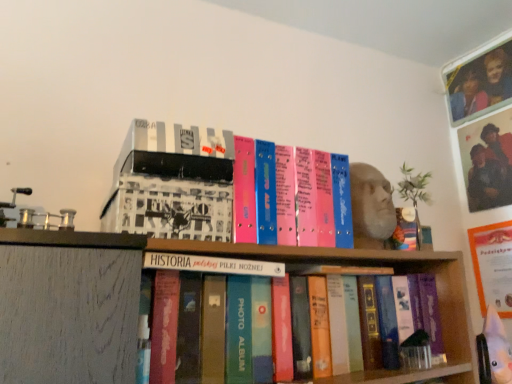
This screenshot has width=512, height=384. Describe the element at coordinates (480, 83) in the screenshot. I see `matte plastic photo frame at upper right` at that location.

Locate an element on the screen. The height and width of the screenshot is (384, 512). white matte box at upper left, which ranks as the 2th book in bottom-to-top order is located at coordinates (170, 208).

Image resolution: width=512 pixels, height=384 pixels. I want to click on matte plastic photo frame at upper right, so click(x=480, y=83).

Is orange matte paper at upper right wider than white matte box at upper left, which ranks as the 2th book in bottom-to-top order?

Incorrect, the width of orange matte paper at upper right does not surpass that of white matte box at upper left, which ranks as the 2th book in bottom-to-top order.

Would you say orange matte paper at upper right is a long distance from white matte box at upper left, which ranks as the 2th book in bottom-to-top order?

Yes, orange matte paper at upper right is far from white matte box at upper left, which ranks as the 2th book in bottom-to-top order.

Image resolution: width=512 pixels, height=384 pixels. Identify the location of paperback book below the white matte box at upper left, acting as the first book starting from the top (from a real-world perspective). (493, 266).

Is white matte box at upper left, acting as the first book starting from the top, surrounded by orange matte paper at upper right?

That's incorrect, white matte box at upper left, acting as the first book starting from the top, is not inside orange matte paper at upper right.

From a real-world perspective, which object rests below the other?

In real-world perspective, hardcover book at center, which ranks as the first book in bottom-to-top order, is lower.

Is hardcover book at center, which is the 2th book in top-to-bottom order, outside of white matte box at upper left, which ranks as the 2th book in bottom-to-top order?

Yes, hardcover book at center, which is the 2th book in top-to-bottom order, is not within white matte box at upper left, which ranks as the 2th book in bottom-to-top order.

Is hardcover book at center, which is the 2th book in top-to-bottom order, beside white matte box at upper left, which ranks as the 2th book in bottom-to-top order?

Indeed, hardcover book at center, which is the 2th book in top-to-bottom order, and white matte box at upper left, which ranks as the 2th book in bottom-to-top order, are beside each other and touching.

Which is behind, point (214, 269) or point (162, 212)?

The point (214, 269) is farther.

Is orange matte paper at upper right looking in the opposite direction of hardcover book at center, which ranks as the first book in bottom-to-top order?

No, orange matte paper at upper right is not facing away from hardcover book at center, which ranks as the first book in bottom-to-top order.

In the scene shown: From the image's perspective, does orange matte paper at upper right appear higher than hardcover book at center, which is the 2th book in top-to-bottom order?

No, from the image's perspective, orange matte paper at upper right is not on top of hardcover book at center, which is the 2th book in top-to-bottom order.

Is orange matte paper at upper right shorter than hardcover book at center, which ranks as the first book in bottom-to-top order?

No, orange matte paper at upper right is not shorter than hardcover book at center, which ranks as the first book in bottom-to-top order.

From the image's perspective, which one is positioned higher, matte plastic photo frame at upper right or white matte box at upper left, which ranks as the 2th book in bottom-to-top order?

matte plastic photo frame at upper right.

Would you say matte plastic photo frame at upper right is a long distance from white matte box at upper left, acting as the first book starting from the top?

That's right, there is a large distance between matte plastic photo frame at upper right and white matte box at upper left, acting as the first book starting from the top.

Does point (478, 100) come behind point (150, 177)?

Yes, it is behind point (150, 177).

Is orange matte paper at upper right at the back of matte plastic photo frame at upper right?

That's not correct — matte plastic photo frame at upper right is not looking away from orange matte paper at upper right.

From a real-world perspective, who is located lower, matte plastic photo frame at upper right or orange matte paper at upper right?

orange matte paper at upper right is physically lower.

Considering the relative sizes of matte plastic photo frame at upper right and orange matte paper at upper right in the image provided, is matte plastic photo frame at upper right bigger than orange matte paper at upper right?

Yes.

Which object is positioned more to the left, matte plastic photo frame at upper right or orange matte paper at upper right?

Positioned to the left is orange matte paper at upper right.

Is point (507, 275) positioned behind point (494, 70)?

No, (507, 275) is closer to viewer.

How many degrees apart are the facing directions of orange matte paper at upper right and matte plastic photo frame at upper right?

0 degrees separate the facing orientations of orange matte paper at upper right and matte plastic photo frame at upper right.

Can you confirm if orange matte paper at upper right is positioned to the right of matte plastic photo frame at upper right?

In fact, orange matte paper at upper right is to the left of matte plastic photo frame at upper right.

Considering the sizes of objects orange matte paper at upper right and matte plastic photo frame at upper right in the image provided, who is thinner, orange matte paper at upper right or matte plastic photo frame at upper right?

matte plastic photo frame at upper right is thinner.

Locate an element on the screen. This screenshot has height=384, width=512. book that appears below the white matte box at upper left, which ranks as the 2th book in bottom-to-top order (from a real-world perspective) is located at coordinates (212, 264).

Which point is more distant from viewer, (178,185) or (263,267)?

The point (263,267) is farther.

Is white matte box at upper left, which ranks as the 2th book in bottom-to-top order, smaller than hardcover book at center, which ranks as the first book in bottom-to-top order?

No, white matte box at upper left, which ranks as the 2th book in bottom-to-top order, is not smaller than hardcover book at center, which ranks as the first book in bottom-to-top order.

Locate an element on the screen. paperback book behind the white matte box at upper left, which ranks as the 2th book in bottom-to-top order is located at coordinates (493, 266).

Where is `book below the white matte box at upper left, acting as the first book starting from the top (from the image's perspective)`? The height and width of the screenshot is (384, 512). book below the white matte box at upper left, acting as the first book starting from the top (from the image's perspective) is located at coordinates (212, 264).

Considering their positions, is hardcover book at center, which ranks as the first book in bottom-to-top order, positioned closer to orange matte paper at upper right than white matte box at upper left, acting as the first book starting from the top?

The object closer to orange matte paper at upper right is hardcover book at center, which ranks as the first book in bottom-to-top order.

From the image, which object appears to be nearer to white matte box at upper left, which ranks as the 2th book in bottom-to-top order, matte plastic photo frame at upper right or orange matte paper at upper right?

orange matte paper at upper right is positioned closer to the anchor white matte box at upper left, which ranks as the 2th book in bottom-to-top order.

Which object lies nearer to the anchor point hardcover book at center, which ranks as the first book in bottom-to-top order, matte plastic photo frame at upper right or orange matte paper at upper right?

Among the two, orange matte paper at upper right is located nearer to hardcover book at center, which ranks as the first book in bottom-to-top order.

Looking at the image, which one is located closer to white matte box at upper left, which ranks as the 2th book in bottom-to-top order, matte plastic photo frame at upper right or hardcover book at center, which is the 2th book in top-to-bottom order?

The object closer to white matte box at upper left, which ranks as the 2th book in bottom-to-top order, is hardcover book at center, which is the 2th book in top-to-bottom order.

Considering their positions, is hardcover book at center, which ranks as the first book in bottom-to-top order, positioned closer to matte plastic photo frame at upper right than white matte box at upper left, which ranks as the 2th book in bottom-to-top order?

hardcover book at center, which ranks as the first book in bottom-to-top order, lies closer to matte plastic photo frame at upper right than the other object.

Considering their positions, is hardcover book at center, which is the 2th book in top-to-bottom order, positioned closer to matte plastic photo frame at upper right than orange matte paper at upper right?

orange matte paper at upper right.

From the image, which object appears to be farther from hardcover book at center, which is the 2th book in top-to-bottom order, orange matte paper at upper right or white matte box at upper left, acting as the first book starting from the top?

orange matte paper at upper right.

Looking at this image, which object lies nearer to the anchor point orange matte paper at upper right, matte plastic photo frame at upper right or hardcover book at center, which is the 2th book in top-to-bottom order?

matte plastic photo frame at upper right lies closer to orange matte paper at upper right than the other object.

You are a GUI agent. You are given a task and a screenshot of the screen. Output one action in this format:
    pyautogui.click(x=<x>, y=<y>)
    Task: Click on the paperback book located between white matte box at upper left, which ranks as the 2th book in bottom-to-top order, and matte plastic photo frame at upper right in the left-right direction
    The height and width of the screenshot is (384, 512).
    Given the screenshot: What is the action you would take?
    pyautogui.click(x=493, y=266)

You are a GUI agent. You are given a task and a screenshot of the screen. Output one action in this format:
    pyautogui.click(x=<x>, y=<y>)
    Task: Click on the book situated between white matte box at upper left, which ranks as the 2th book in bottom-to-top order, and matte plastic photo frame at upper right from left to right
    This screenshot has width=512, height=384.
    Given the screenshot: What is the action you would take?
    pyautogui.click(x=212, y=264)

Where is `paperback book between hardcover book at center, which is the 2th book in top-to-bottom order, and matte plastic photo frame at upper right from left to right`? The height and width of the screenshot is (384, 512). paperback book between hardcover book at center, which is the 2th book in top-to-bottom order, and matte plastic photo frame at upper right from left to right is located at coordinates (493, 266).

Locate an element on the screen. This screenshot has height=384, width=512. book between white matte box at upper left, acting as the first book starting from the top, and orange matte paper at upper right, in the horizontal direction is located at coordinates (212, 264).